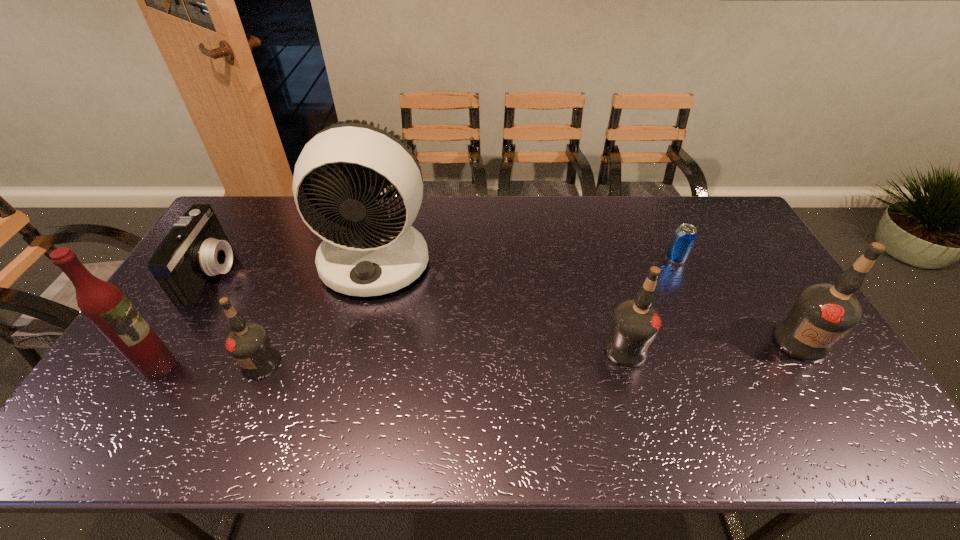
Locate an element on the screen. The image size is (960, 540). vacant space in between the rightmost vodka and the shortest object is located at coordinates (738, 300).

The width and height of the screenshot is (960, 540). What are the coordinates of `vacant region between the fifth tallest object and the second object from right to left` in the screenshot? It's located at (468, 311).

The width and height of the screenshot is (960, 540). In order to click on free space between the liquor and the shortest object in this screenshot , I will do `click(418, 312)`.

Identify which object is the fifth nearest to the fifth tallest object. Please provide its 2D coordinates. Your answer should be formatted as a tuple, i.e. [(x, y)], where the tuple contains the x and y coordinates of a point satisfying the conditions above.

[(685, 235)]

Image resolution: width=960 pixels, height=540 pixels. Find the location of `object that ranks as the third closest to the rightmost object`. object that ranks as the third closest to the rightmost object is located at coordinates (365, 252).

You are a GUI agent. You are given a task and a screenshot of the screen. Output one action in this format:
    pyautogui.click(x=<x>, y=<y>)
    Task: Click on the vodka that stands as the third closest to the second shortest object
    This screenshot has width=960, height=540.
    Given the screenshot: What is the action you would take?
    pyautogui.click(x=822, y=313)

You are a GUI agent. You are given a task and a screenshot of the screen. Output one action in this format:
    pyautogui.click(x=<x>, y=<y>)
    Task: Click on the third closest vodka relative to the liquor
    This screenshot has width=960, height=540.
    Given the screenshot: What is the action you would take?
    pyautogui.click(x=822, y=313)

The width and height of the screenshot is (960, 540). What are the coordinates of `free location that satisfies the following two spatial constraints: 1. on the grille of the fan; 2. on the label of the liquor` in the screenshot? It's located at (349, 366).

You are a GUI agent. You are given a task and a screenshot of the screen. Output one action in this format:
    pyautogui.click(x=<x>, y=<y>)
    Task: Click on the vacant space that satisfies the following two spatial constraints: 1. on the front label of the fifth tallest object; 2. on the label of the liquor
    
    Given the screenshot: What is the action you would take?
    pyautogui.click(x=260, y=366)